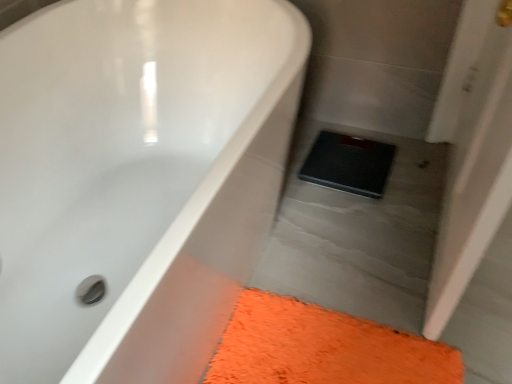
Where is `black rubber scale at center`? Image resolution: width=512 pixels, height=384 pixels. black rubber scale at center is located at coordinates (349, 164).

The width and height of the screenshot is (512, 384). Describe the element at coordinates (323, 348) in the screenshot. I see `orange shaggy bath mat at lower right` at that location.

Where is `white glossy bathtub at upper left`? This screenshot has width=512, height=384. white glossy bathtub at upper left is located at coordinates (138, 180).

This screenshot has width=512, height=384. In order to click on black rubber scale at center in this screenshot , I will do `click(349, 164)`.

Consider the image. Considering the positions of objects white glossy bathtub at upper left and black rubber scale at center in the image provided, who is more to the right, white glossy bathtub at upper left or black rubber scale at center?

Result: From the viewer's perspective, black rubber scale at center appears more on the right side.

The image size is (512, 384). Find the location of `pad below the white glossy bathtub at upper left (from a real-world perspective)`. pad below the white glossy bathtub at upper left (from a real-world perspective) is located at coordinates (349, 164).

Can you tell me how much white glossy bathtub at upper left and black rubber scale at center differ in facing direction?

92.2 degrees separate the facing orientations of white glossy bathtub at upper left and black rubber scale at center.

Considering the sizes of objects white glossy bathtub at upper left and black rubber scale at center in the image provided, who is bigger, white glossy bathtub at upper left or black rubber scale at center?

white glossy bathtub at upper left.

From the image's perspective, would you say black rubber scale at center is shown under white glossy bathtub at upper left?

Incorrect, from the image's perspective, black rubber scale at center is higher than white glossy bathtub at upper left.

From a real-world perspective, is black rubber scale at center below white glossy bathtub at upper left?

Yes, from a real-world perspective, black rubber scale at center is beneath white glossy bathtub at upper left.

Is black rubber scale at center aimed at white glossy bathtub at upper left?

No, black rubber scale at center is not aimed at white glossy bathtub at upper left.

Consider the image. Considering the positions of objects black rubber scale at center and white glossy bathtub at upper left in the image provided, who is more to the left, black rubber scale at center or white glossy bathtub at upper left?

Positioned to the left is white glossy bathtub at upper left.

Is orange shaggy bath mat at lower right at the back of black rubber scale at center?

No, orange shaggy bath mat at lower right is not at the back of black rubber scale at center.

From a real-world perspective, between black rubber scale at center and orange shaggy bath mat at lower right, who is vertically lower?

orange shaggy bath mat at lower right is physically lower.

How distant is black rubber scale at center from orange shaggy bath mat at lower right?

A distance of 22.29 inches exists between black rubber scale at center and orange shaggy bath mat at lower right.

Considering the sizes of black rubber scale at center and orange shaggy bath mat at lower right in the image, is black rubber scale at center wider or thinner than orange shaggy bath mat at lower right?

black rubber scale at center is thinner than orange shaggy bath mat at lower right.

Between orange shaggy bath mat at lower right and black rubber scale at center, which one is positioned behind?

black rubber scale at center is further away from the camera.

Based on the photo, from the image's perspective, is orange shaggy bath mat at lower right under black rubber scale at center?

Correct, orange shaggy bath mat at lower right appears lower than black rubber scale at center in the image.

Are orange shaggy bath mat at lower right and black rubber scale at center far apart?

They are positioned close to each other.

Consider the image. Is orange shaggy bath mat at lower right oriented towards black rubber scale at center?

No, orange shaggy bath mat at lower right is not turned towards black rubber scale at center.

In the image, there is a orange shaggy bath mat at lower right. Identify the location of bathtub above it (from the image's perspective). tap(138, 180).

From the picture: Who is more distant, orange shaggy bath mat at lower right or white glossy bathtub at upper left?

Positioned behind is orange shaggy bath mat at lower right.

Looking at this image, is orange shaggy bath mat at lower right not inside white glossy bathtub at upper left?

Yes.

From a real-world perspective, between orange shaggy bath mat at lower right and white glossy bathtub at upper left, who is vertically lower?

orange shaggy bath mat at lower right, from a real-world perspective.

What's the angular difference between white glossy bathtub at upper left and orange shaggy bath mat at lower right's facing directions?

The angular difference between white glossy bathtub at upper left and orange shaggy bath mat at lower right is 0.000554 degrees.

Is white glossy bathtub at upper left facing away from orange shaggy bath mat at lower right?

white glossy bathtub at upper left does not have its back to orange shaggy bath mat at lower right.

Who is smaller, white glossy bathtub at upper left or orange shaggy bath mat at lower right?

Smaller between the two is orange shaggy bath mat at lower right.

Where is `bathtub on the left of black rubber scale at center`? bathtub on the left of black rubber scale at center is located at coordinates (138, 180).

This screenshot has height=384, width=512. What are the coordinates of `bathtub above the black rubber scale at center (from a real-world perspective)` in the screenshot? It's located at (138, 180).

Considering their positions, is black rubber scale at center positioned further to white glossy bathtub at upper left than orange shaggy bath mat at lower right?

Based on the image, black rubber scale at center appears to be further to white glossy bathtub at upper left.

When comparing their distances from orange shaggy bath mat at lower right, does white glossy bathtub at upper left or black rubber scale at center seem further?

Based on the image, black rubber scale at center appears to be further to orange shaggy bath mat at lower right.

When comparing their distances from white glossy bathtub at upper left, does orange shaggy bath mat at lower right or black rubber scale at center seem closer?

The object closer to white glossy bathtub at upper left is orange shaggy bath mat at lower right.

Considering their positions, is white glossy bathtub at upper left positioned further to black rubber scale at center than orange shaggy bath mat at lower right?

white glossy bathtub at upper left lies further to black rubber scale at center than the other object.

When comparing their distances from black rubber scale at center, does orange shaggy bath mat at lower right or white glossy bathtub at upper left seem further?

white glossy bathtub at upper left.

Estimate the real-world distances between objects in this image. Which object is closer to orange shaggy bath mat at lower right, black rubber scale at center or white glossy bathtub at upper left?

white glossy bathtub at upper left.

The height and width of the screenshot is (384, 512). Find the location of `bath mat between white glossy bathtub at upper left and black rubber scale at center along the z-axis`. bath mat between white glossy bathtub at upper left and black rubber scale at center along the z-axis is located at coordinates (323, 348).